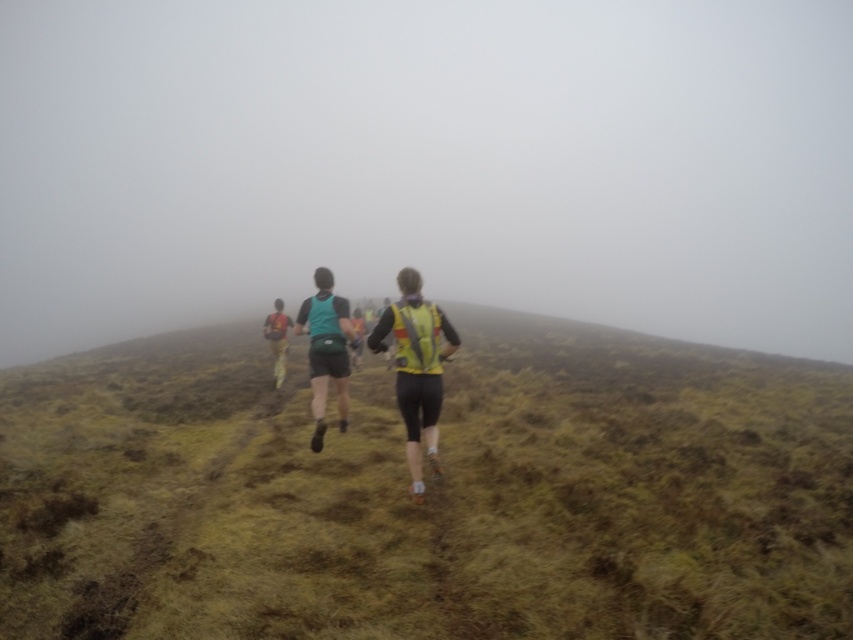
You are a runner participating in a race on the grassy hillside. You notice two runners ahead of you wearing yellow reflective vests with red accents. The first runner is wearing a green grassy at center. The second runner is wearing a different color vest. How far apart are the two runners?

The two runners are 3.79 meters apart.

You are a runner approaching the green grassy at center and the teal fabric vest at center. Which object will you encounter first?

The green grassy at center is closer to the viewer than the teal fabric vest at center, so you will encounter the green grassy at center first.

You are a runner participating in a race on the grassy hillside. You notice the green grassy at center and the teal fabric vest at center. Which object is closer to you?

The teal fabric vest at center is closer because it is only 5.78 meters away from the green grassy at center, but the question is about which is closer to you. Wait, the description says the distance between them is 5.78 meters. The question asks which is closer to the runner. Hmm, but the scene says the runners are on the hillside, and the objects are both at center. Maybe the vest is on a runner, so the vest is part of the runner, so the grass is 5.78 meters from the vest. So if the runner is at the vest,